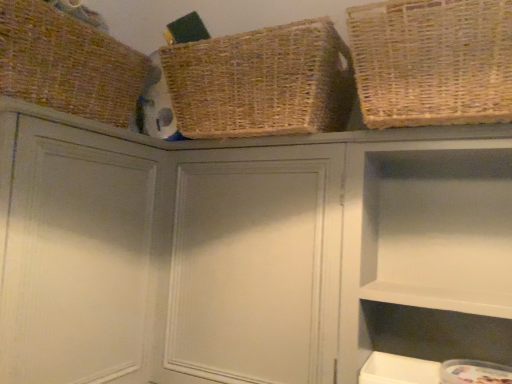
Question: In which direction should I rotate to look at woven natural basket at upper center, the second basket positioned from the right?

Choices:
 (A) right
 (B) left

Answer: (A)

Question: Can you confirm if natural woven basket at upper right, which is the first basket in right-to-left order, is taller than woven natural basket at upper center, the second basket positioned from the right?

Choices:
 (A) yes
 (B) no

Answer: (B)

Question: Is natural woven basket at upper right, which is the first basket in right-to-left order, completely or partially outside of woven natural basket at upper center, arranged as the 2th basket when viewed from the left?

Choices:
 (A) yes
 (B) no

Answer: (A)

Question: Considering the relative sizes of natural woven basket at upper right, which is the first basket in right-to-left order, and woven natural basket at upper center, the second basket positioned from the right, in the image provided, is natural woven basket at upper right, which is the first basket in right-to-left order, thinner than woven natural basket at upper center, the second basket positioned from the right,?

Choices:
 (A) yes
 (B) no

Answer: (B)

Question: From the image's perspective, is natural woven basket at upper right, which is the first basket in right-to-left order, under woven natural basket at upper center, the second basket positioned from the right?

Choices:
 (A) yes
 (B) no

Answer: (A)

Question: Does natural woven basket at upper right, acting as the third basket starting from the left, have a larger size compared to woven natural basket at upper center, arranged as the 2th basket when viewed from the left?

Choices:
 (A) yes
 (B) no

Answer: (B)

Question: Are natural woven basket at upper right, acting as the third basket starting from the left, and woven natural basket at upper center, arranged as the 2th basket when viewed from the left, far apart?

Choices:
 (A) no
 (B) yes

Answer: (A)

Question: Is white matte cabinet at upper right, the first cabinet positioned from the right, at the left side of brown woven basket at upper left, which appears as the first basket when viewed from the left?

Choices:
 (A) no
 (B) yes

Answer: (A)

Question: Is white matte cabinet at upper right, the first cabinet positioned from the right, wider than brown woven basket at upper left, which appears as the first basket when viewed from the left?

Choices:
 (A) yes
 (B) no

Answer: (B)

Question: Is white matte cabinet at upper right, the first cabinet positioned from the right, oriented away from brown woven basket at upper left, which appears as the first basket when viewed from the left?

Choices:
 (A) yes
 (B) no

Answer: (B)

Question: Is there a large distance between white matte cabinet at upper right, the first cabinet positioned from the right, and brown woven basket at upper left, which appears as the first basket when viewed from the left?

Choices:
 (A) no
 (B) yes

Answer: (A)

Question: Is white matte cabinet at upper right, the third cabinet from the left, aimed at brown woven basket at upper left, which appears as the first basket when viewed from the left?

Choices:
 (A) yes
 (B) no

Answer: (B)

Question: From a real-world perspective, does white matte cabinet at upper right, the first cabinet positioned from the right, sit lower than brown woven basket at upper left, which appears as the first basket when viewed from the left?

Choices:
 (A) yes
 (B) no

Answer: (A)

Question: Is woven natural basket at upper center, arranged as the 2th basket when viewed from the left, positioned with its back to brown woven basket at upper left, positioned as the third basket in right-to-left order?

Choices:
 (A) no
 (B) yes

Answer: (A)